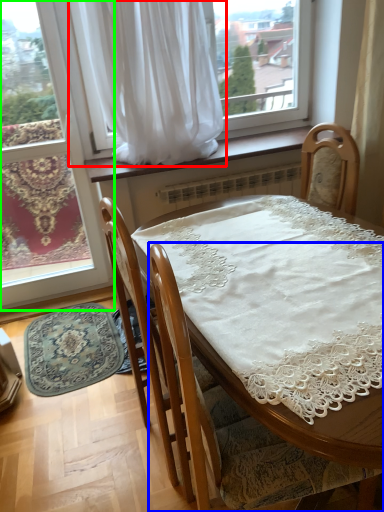
Question: Which object is positioned closest to curtain (highlighted by a red box)? Select from chair (highlighted by a blue box) and window (highlighted by a green box).

Choices:
 (A) chair
 (B) window

Answer: (B)